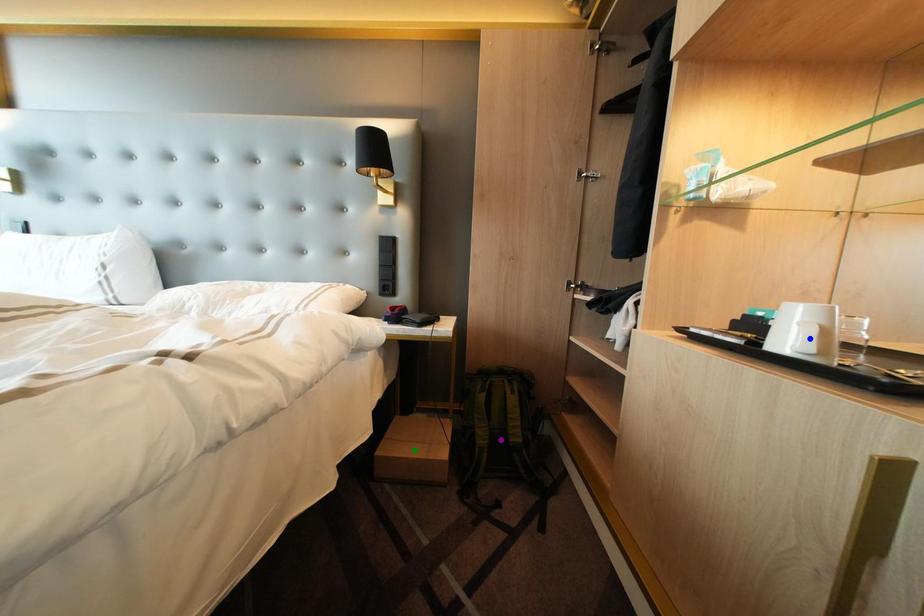
Consider the image. Order these from nearest to farthest:
- purple point
- blue point
- green point

blue point
purple point
green point